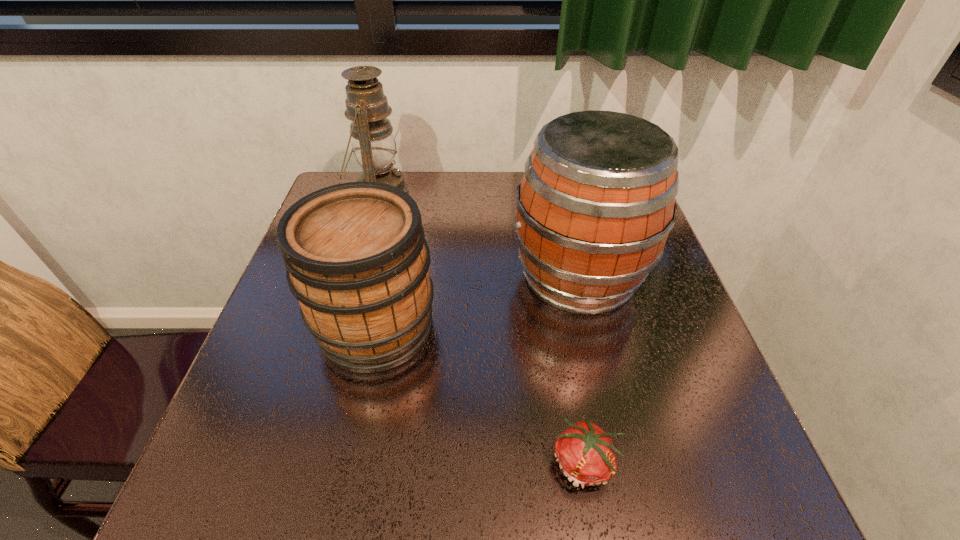
Where is `vacant space at the far left corner of the desktop`? This screenshot has width=960, height=540. vacant space at the far left corner of the desktop is located at coordinates (355, 178).

The width and height of the screenshot is (960, 540). In the image, there is a desktop. In order to click on vacant space at the near right corner in this screenshot , I will do `click(684, 480)`.

Find the location of a particular element. This screenshot has width=960, height=540. free space that is in between the farthest object and the nearest object is located at coordinates (482, 328).

The width and height of the screenshot is (960, 540). I want to click on vacant space that's between the oil lamp and the tomato, so click(482, 328).

At what (x,y) coordinates should I click in order to perform the action: click on blank region between the second shortest object and the nearest object. Please return your answer as a coordinate pair (x, y). Looking at the image, I should click on (481, 395).

The image size is (960, 540). In order to click on empty location between the nearest object and the shorter cider in this screenshot , I will do `click(481, 395)`.

Locate an element on the screen. Image resolution: width=960 pixels, height=540 pixels. free spot between the shorter cider and the taller cider is located at coordinates (477, 301).

I want to click on vacant space in between the shorter cider and the right cider, so click(477, 301).

At what (x,y) coordinates should I click in order to perform the action: click on free space that is in between the oil lamp and the nearest object. Please return your answer as a coordinate pair (x, y). Looking at the image, I should click on (482, 328).

At what (x,y) coordinates should I click in order to perform the action: click on free area in between the oil lamp and the tomato. Please return your answer as a coordinate pair (x, y). Looking at the image, I should click on point(482,328).